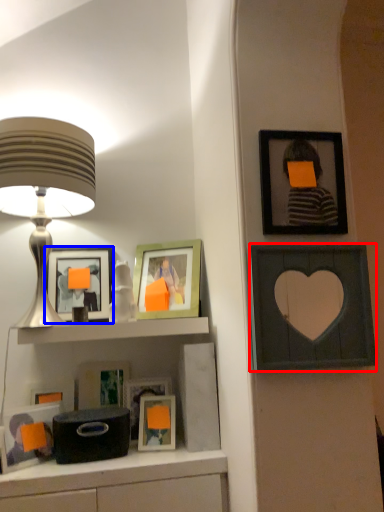
Question: Among these objects, which one is nearest to the camera, picture frame (highlighted by a red box) or picture frame (highlighted by a blue box)?

Choices:
 (A) picture frame
 (B) picture frame

Answer: (A)